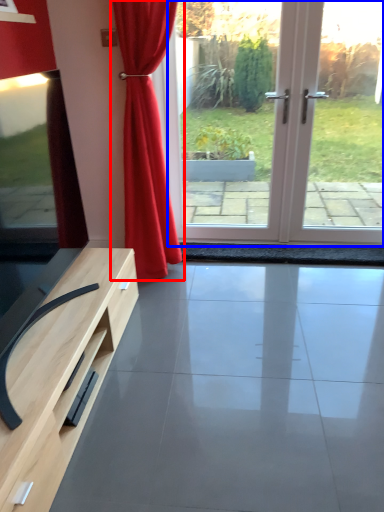
Question: Which point is closer to the camera, curtain (highlighted by a red box) or screen door (highlighted by a blue box)?

Choices:
 (A) curtain
 (B) screen door

Answer: (A)